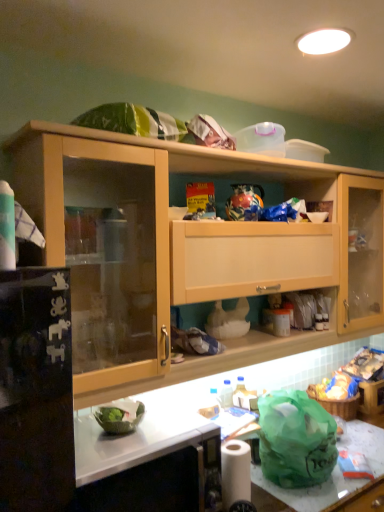
Question: From the image's perspective, is white glossy countertop at lower center, arranged as the second counter top when ordered from the bottom, below white matte toilet paper at lower center?

Choices:
 (A) yes
 (B) no

Answer: (B)

Question: Is white glossy countertop at lower center, which ranks as the first counter top in left-to-right order, oriented towards white matte toilet paper at lower center?

Choices:
 (A) no
 (B) yes

Answer: (A)

Question: Does white glossy countertop at lower center, arranged as the second counter top when ordered from the bottom, appear on the right side of white matte toilet paper at lower center?

Choices:
 (A) yes
 (B) no

Answer: (B)

Question: Is white glossy countertop at lower center, placed as the first counter top when sorted from top to bottom, behind white matte toilet paper at lower center?

Choices:
 (A) no
 (B) yes

Answer: (A)

Question: Considering the relative sizes of white glossy countertop at lower center, arranged as the second counter top when ordered from the bottom, and white matte toilet paper at lower center in the image provided, is white glossy countertop at lower center, arranged as the second counter top when ordered from the bottom, thinner than white matte toilet paper at lower center?

Choices:
 (A) no
 (B) yes

Answer: (A)

Question: From the image's perspective, is white glossy countertop at lower center, which ranks as the first counter top in left-to-right order, located above or below white matte toilet paper at lower center?

Choices:
 (A) above
 (B) below

Answer: (A)

Question: Based on their positions, is white glossy countertop at lower center, placed as the first counter top when sorted from top to bottom, located to the left or right of white matte toilet paper at lower center?

Choices:
 (A) left
 (B) right

Answer: (A)

Question: From a real-world perspective, is white glossy countertop at lower center, arranged as the second counter top when ordered from the bottom, above or below white matte toilet paper at lower center?

Choices:
 (A) below
 (B) above

Answer: (B)

Question: Considering the positions of white glossy countertop at lower center, positioned as the second counter top in right-to-left order, and white matte toilet paper at lower center in the image, is white glossy countertop at lower center, positioned as the second counter top in right-to-left order, wider or thinner than white matte toilet paper at lower center?

Choices:
 (A) wide
 (B) thin

Answer: (A)

Question: In the image, is white glossy countertop at lower center, which ranks as the first counter top in left-to-right order, positioned in front of or behind white marble countertop at lower center?

Choices:
 (A) front
 (B) behind

Answer: (A)

Question: From the image's perspective, is white glossy countertop at lower center, arranged as the second counter top when ordered from the bottom, located above or below white marble countertop at lower center?

Choices:
 (A) above
 (B) below

Answer: (A)

Question: Is white glossy countertop at lower center, which ranks as the first counter top in left-to-right order, spatially inside white marble countertop at lower center, or outside of it?

Choices:
 (A) inside
 (B) outside

Answer: (B)

Question: Is point click(x=89, y=449) positioned closer to the camera than point click(x=190, y=394)?

Choices:
 (A) farther
 (B) closer

Answer: (B)

Question: Considering the relative positions of white matte toilet paper at lower center and white glossy countertop at lower center, positioned as the second counter top in right-to-left order, in the image provided, is white matte toilet paper at lower center to the left or to the right of white glossy countertop at lower center, positioned as the second counter top in right-to-left order,?

Choices:
 (A) right
 (B) left

Answer: (A)

Question: Is white matte toilet paper at lower center wider or thinner than white glossy countertop at lower center, placed as the first counter top when sorted from top to bottom?

Choices:
 (A) wide
 (B) thin

Answer: (B)